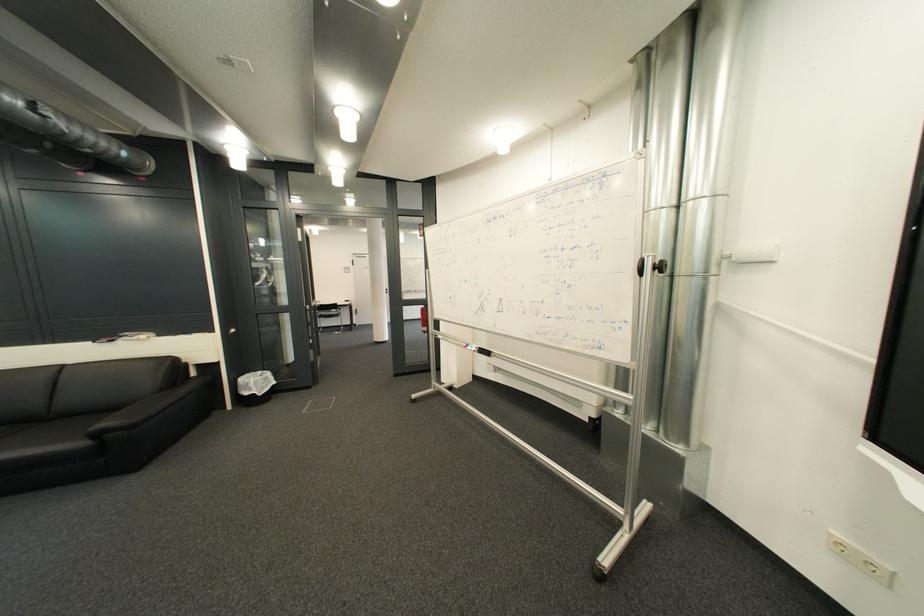
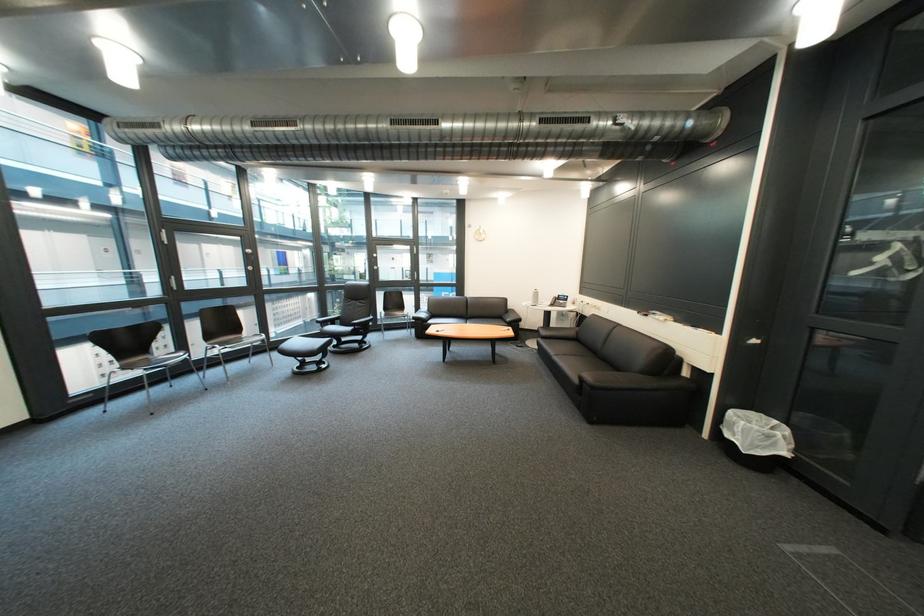
Locate, in the second image, the point that corresponds to (111,437) in the first image.

(594, 381)